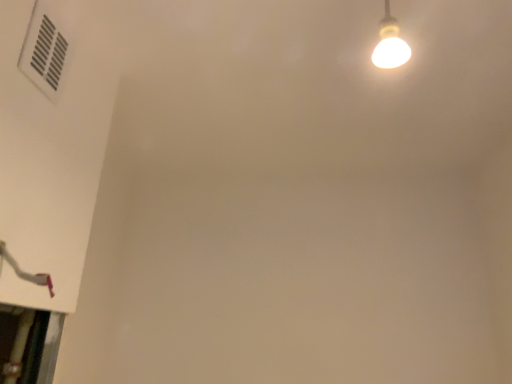
The height and width of the screenshot is (384, 512). Describe the element at coordinates (44, 52) in the screenshot. I see `white plastic air conditioning at upper left` at that location.

In order to click on white plastic air conditioning at upper left in this screenshot , I will do `click(44, 52)`.

Measure the distance between point (53, 29) and camera.

Point (53, 29) is 34.37 inches away from camera.

You are a GUI agent. You are given a task and a screenshot of the screen. Output one action in this format:
    pyautogui.click(x=<x>, y=<y>)
    Task: Click on the white plastic air conditioning at upper left
    The height and width of the screenshot is (384, 512).
    Given the screenshot: What is the action you would take?
    pyautogui.click(x=44, y=52)